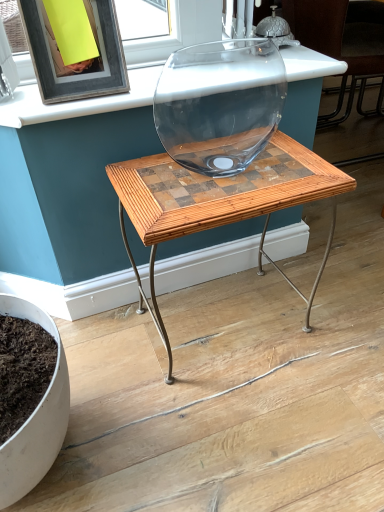
Question: Can you confirm if transparent glass vase at center is shorter than wooden mosaic table at center?

Choices:
 (A) yes
 (B) no

Answer: (B)

Question: Could you tell me if transparent glass vase at center is facing wooden mosaic table at center?

Choices:
 (A) no
 (B) yes

Answer: (A)

Question: Is transparent glass vase at center not close to wooden mosaic table at center?

Choices:
 (A) yes
 (B) no

Answer: (B)

Question: Is transparent glass vase at center next to wooden mosaic table at center?

Choices:
 (A) yes
 (B) no

Answer: (B)

Question: From the image's perspective, is transparent glass vase at center on top of wooden mosaic table at center?

Choices:
 (A) no
 (B) yes

Answer: (B)

Question: Is matte black frame at upper left situated inside wooden mosaic table at center or outside?

Choices:
 (A) outside
 (B) inside

Answer: (A)

Question: Is matte black frame at upper left to the left or to the right of wooden mosaic table at center in the image?

Choices:
 (A) right
 (B) left

Answer: (B)

Question: Is matte black frame at upper left taller or shorter than wooden mosaic table at center?

Choices:
 (A) tall
 (B) short

Answer: (B)

Question: From a real-world perspective, is matte black frame at upper left above or below wooden mosaic table at center?

Choices:
 (A) above
 (B) below

Answer: (A)

Question: Is transparent glass bowl at upper center inside or outside of matte black frame at upper left?

Choices:
 (A) inside
 (B) outside

Answer: (B)

Question: Is transparent glass bowl at upper center to the left or to the right of matte black frame at upper left in the image?

Choices:
 (A) left
 (B) right

Answer: (B)

Question: Is point (309, 60) closer or farther from the camera than point (29, 7)?

Choices:
 (A) farther
 (B) closer

Answer: (A)

Question: In the image, is transparent glass bowl at upper center positioned in front of or behind matte black frame at upper left?

Choices:
 (A) behind
 (B) front

Answer: (A)

Question: Considering the positions of matte black frame at upper left and transparent glass vase at center in the image, is matte black frame at upper left bigger or smaller than transparent glass vase at center?

Choices:
 (A) big
 (B) small

Answer: (B)

Question: Is matte black frame at upper left wider or thinner than transparent glass vase at center?

Choices:
 (A) wide
 (B) thin

Answer: (B)